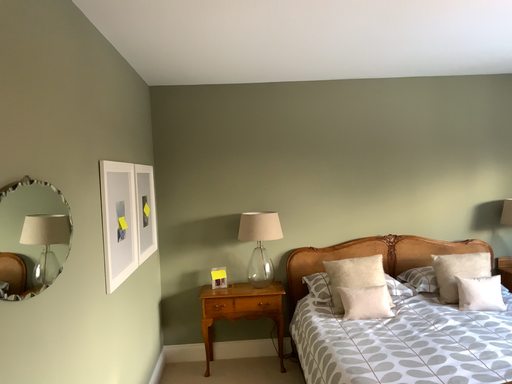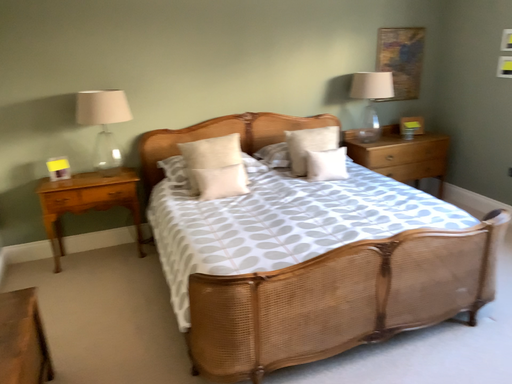
Question: Which way did the camera rotate in the video?

Choices:
 (A) rotated left
 (B) rotated right

Answer: (B)